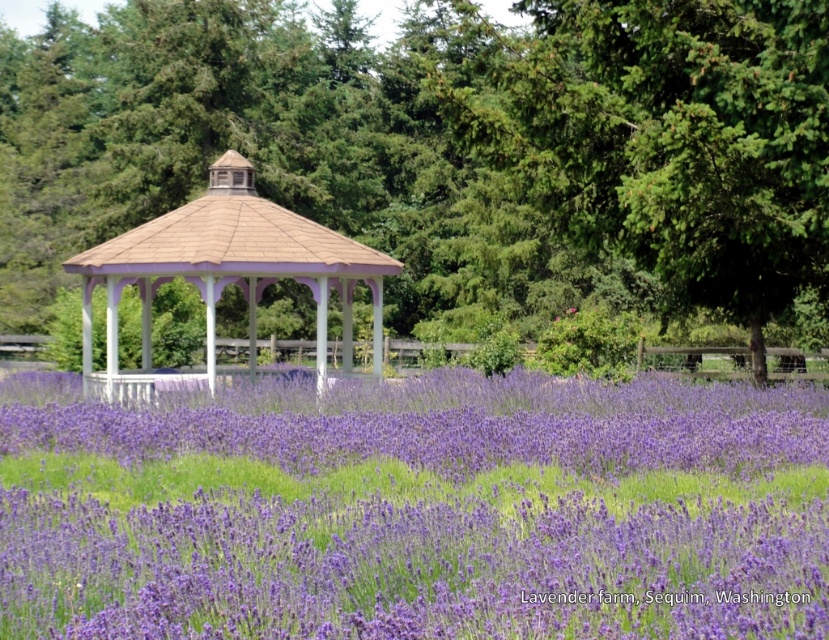
Can you confirm if purple soft lavender at center is wider than matte white gazebo at center?

Yes, purple soft lavender at center is wider than matte white gazebo at center.

Between point (642, 376) and point (211, 358), which one is positioned in front?

Point (211, 358) is in front.

The width and height of the screenshot is (829, 640). I want to click on purple soft lavender at center, so click(x=415, y=509).

Which is more to the left, green leafy tree at center or matte white gazebo at center?

From the viewer's perspective, matte white gazebo at center appears more on the left side.

Is point (131, 208) positioned after point (221, 227)?

Yes, point (131, 208) is farther from viewer.

Between point (551, 132) and point (110, 304), which one is positioned in front?

Positioned in front is point (551, 132).

At what (x,y) coordinates should I click in order to perform the action: click on green leafy tree at center. Please return your answer as a coordinate pair (x, y). This screenshot has width=829, height=640. Looking at the image, I should click on (449, 145).

Measure the distance between point (725, 289) and camera.

Point (725, 289) is 24.17 meters from camera.

What do you see at coordinates (449, 145) in the screenshot?
I see `green leafy tree at center` at bounding box center [449, 145].

Locate an element on the screen. green leafy tree at center is located at coordinates (449, 145).